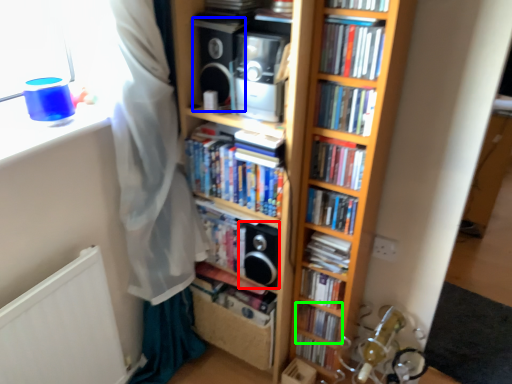
Question: Based on their relative distances, which object is nearer to speaker (highlighted by a red box)? Choose from speaker (highlighted by a blue box) and book (highlighted by a green box).

Choices:
 (A) speaker
 (B) book

Answer: (B)